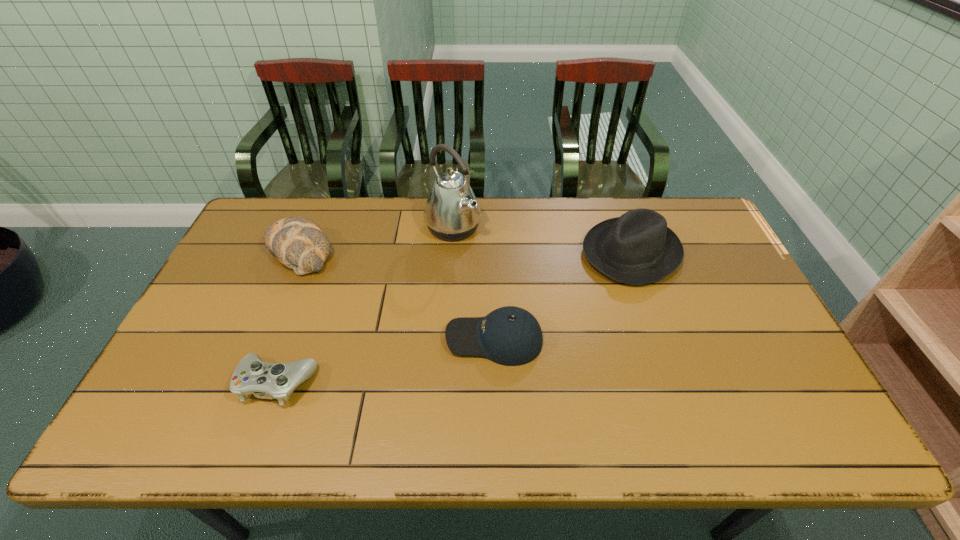
This screenshot has height=540, width=960. Find the location of `free region located 0.160m on the front-facing side of the baseball cap`. free region located 0.160m on the front-facing side of the baseball cap is located at coordinates (386, 339).

Locate an element on the screen. The image size is (960, 540). free region located on the front-facing side of the baseball cap is located at coordinates (326, 339).

The image size is (960, 540). I want to click on free space located on the left of the control, so pos(158,383).

Find the location of a particular element. The height and width of the screenshot is (540, 960). kettle located in the far edge section of the desktop is located at coordinates (452, 212).

At what (x,y) coordinates should I click in order to perform the action: click on fedora situated at the far edge. Please return your answer as a coordinate pair (x, y). This screenshot has width=960, height=540. Looking at the image, I should click on (637, 248).

Where is `bread that is at the far edge`? bread that is at the far edge is located at coordinates (298, 243).

Find the location of `object located in the left edge section of the desktop`. object located in the left edge section of the desktop is located at coordinates (298, 243).

You are a GUI agent. You are given a task and a screenshot of the screen. Output one action in this format:
    pyautogui.click(x=<x>, y=<y>)
    Task: Click on the object that is positioned at the right edge
    
    Given the screenshot: What is the action you would take?
    pyautogui.click(x=637, y=248)

I want to click on object located in the far left corner section of the desktop, so click(x=298, y=243).

Locate an element on the screen. The height and width of the screenshot is (540, 960). object that is at the far right corner is located at coordinates (637, 248).